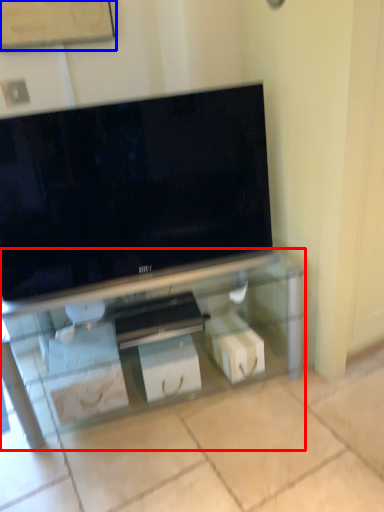
Question: Among these objects, which one is nearest to the camera, furniture (highlighted by a red box) or bulletin board (highlighted by a blue box)?

Choices:
 (A) furniture
 (B) bulletin board

Answer: (A)